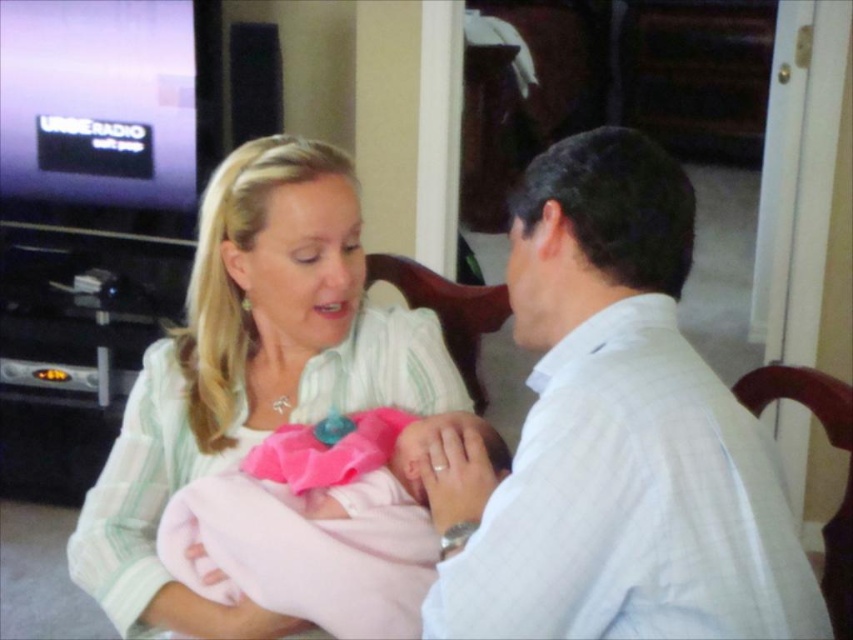
Question: Is white striped shirt at right to the right of pink fabric baby at center from the viewer's perspective?

Choices:
 (A) no
 (B) yes

Answer: (B)

Question: Among these points, which one is farthest from the camera?

Choices:
 (A) (341, 180)
 (B) (265, 541)
 (C) (477, 515)

Answer: (A)

Question: Which point is farther from the camera taking this photo?

Choices:
 (A) (422, 518)
 (B) (312, 282)

Answer: (B)

Question: Does pink fabric baby at center appear under pink satin baby at center?

Choices:
 (A) yes
 (B) no

Answer: (B)

Question: Can you confirm if white striped shirt at right is positioned above pink fabric baby at center?

Choices:
 (A) yes
 (B) no

Answer: (A)

Question: Which point is closer to the camera taking this photo?

Choices:
 (A) (122, 572)
 (B) (463, 620)

Answer: (B)